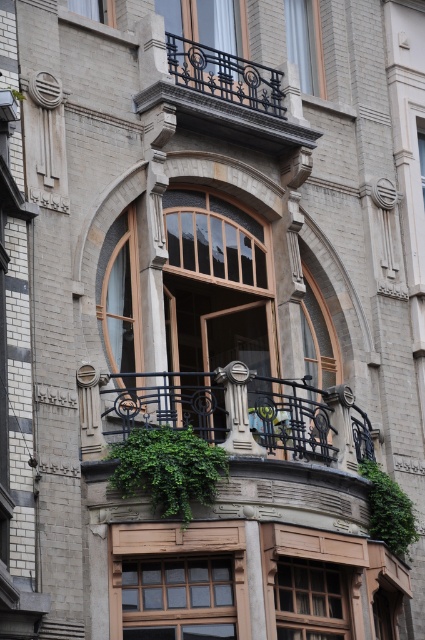
This screenshot has width=425, height=640. I want to click on green leafy plant at right, so point(388,509).

Can you confirm if green leafy plant at right is taller than clear glass window at upper left?

Yes.

What do you see at coordinates (388, 509) in the screenshot? The image size is (425, 640). I see `green leafy plant at right` at bounding box center [388, 509].

Image resolution: width=425 pixels, height=640 pixels. I want to click on green leafy plant at right, so click(x=388, y=509).

Is wooden textured window at lower center further to camera compared to clear glass window at upper center?

No, wooden textured window at lower center is in front of clear glass window at upper center.

Who is higher up, wooden textured window at lower center or clear glass window at upper center?

clear glass window at upper center is above.

The image size is (425, 640). What do you see at coordinates (308, 600) in the screenshot? I see `wooden textured window at lower center` at bounding box center [308, 600].

Where is `wooden textured window at lower center`? The height and width of the screenshot is (640, 425). wooden textured window at lower center is located at coordinates (308, 600).

Which is behind, point (142, 461) or point (176, 42)?

The point (176, 42) is more distant.

Does green leafy plant at center have a lesser height compared to black wrought iron railing at upper center?

In fact, green leafy plant at center may be taller than black wrought iron railing at upper center.

Which is behind, point (130, 486) or point (248, 72)?

The point (248, 72) is more distant.

The image size is (425, 640). In order to click on green leafy plant at center in this screenshot , I will do `click(167, 468)`.